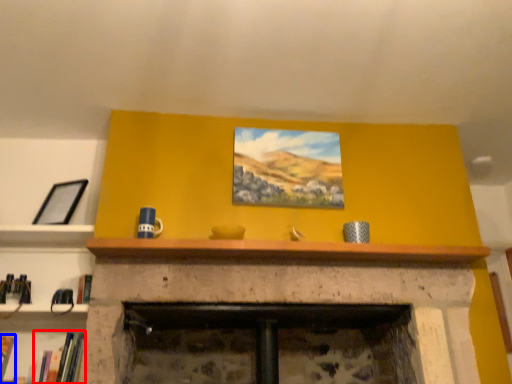
Question: Which object is closer to the camera taking this photo, book (highlighted by a red box) or book (highlighted by a blue box)?

Choices:
 (A) book
 (B) book

Answer: (A)